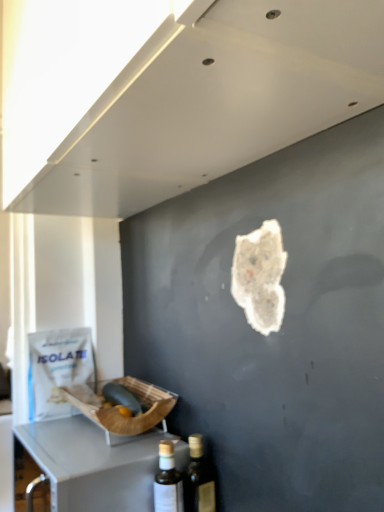
In order to face matte gray desk at lower left, should I rotate leftwards or rightwards?

Turn left approximately 13.984 degrees to face it.

I want to click on matte gray desk at lower left, so click(96, 464).

The image size is (384, 512). Describe the element at coordinates (96, 464) in the screenshot. I see `matte gray desk at lower left` at that location.

Identify the location of matte gray desk at lower left. (96, 464).